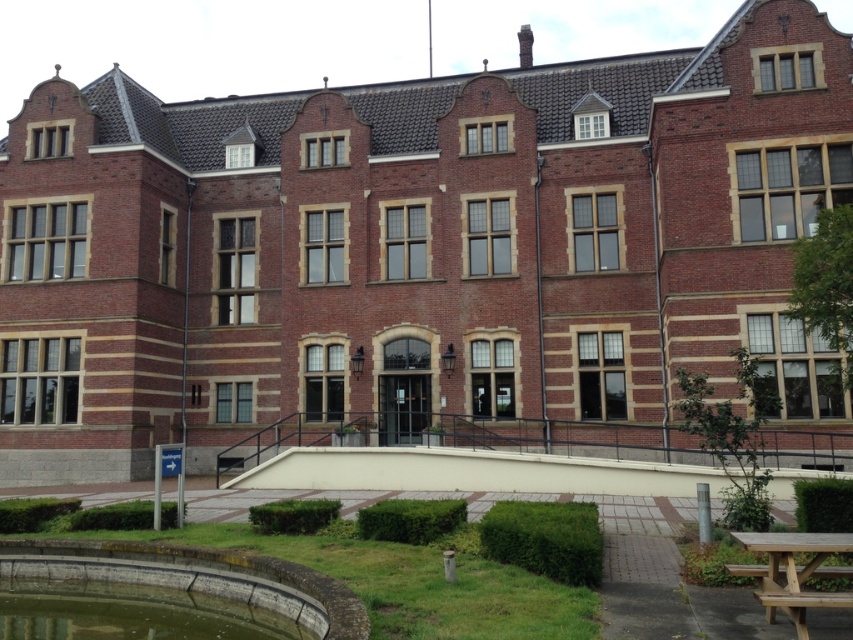
You are standing at the base of the stairs leading to the building and want to walk to the wooden picnic table at lower right. Which direction should you go relative to the green mossy pond at lower left?

Since the green mossy pond at lower left is closer to you than the wooden picnic table at lower right, you should walk away from the green mossy pond at lower left to reach the wooden picnic table at lower right.

You are standing in front of the building and want to walk from the green mossy pond at lower left to the wooden picnic table at lower right. Which direction should you head?

You should head to the right because the green mossy pond at lower left is located to the left of the wooden picnic table at lower right.